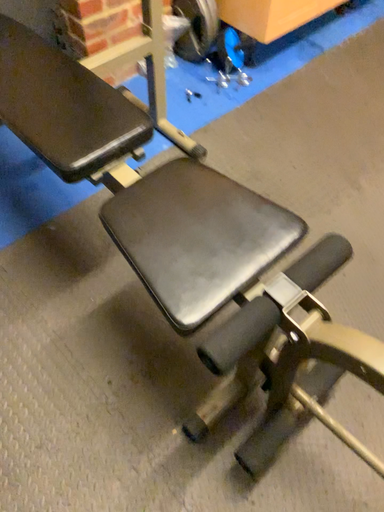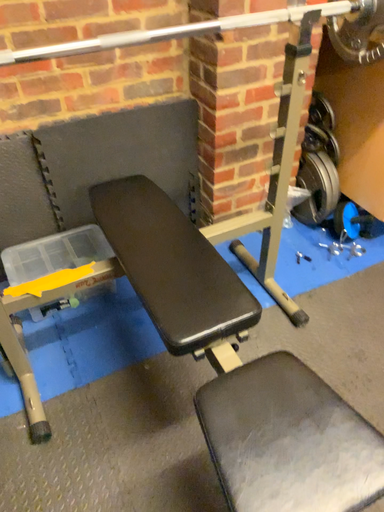
Question: How did the camera likely rotate when shooting the video?

Choices:
 (A) rotated right
 (B) rotated left

Answer: (B)